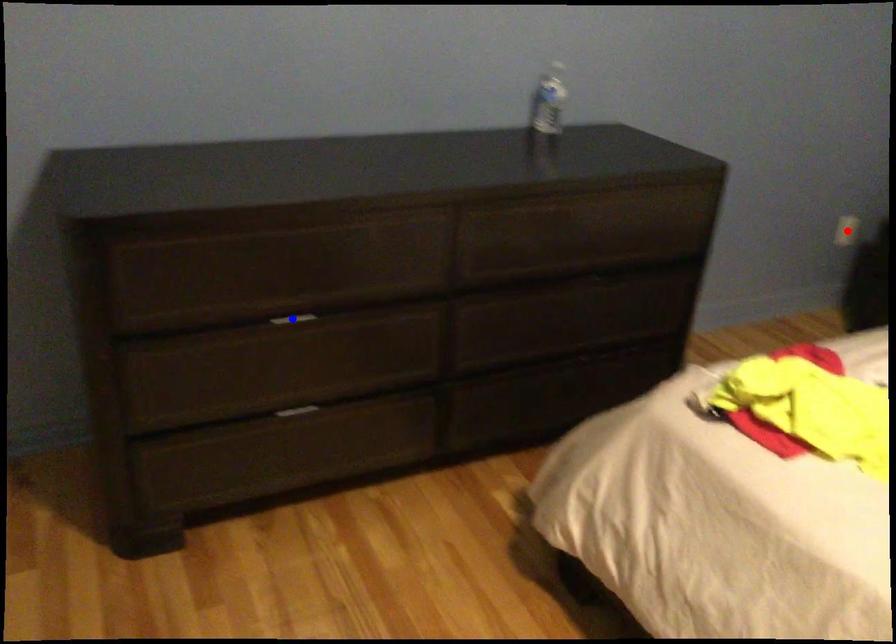
Question: Which of the two points in the image is closer to the camera?

Choices:
 (A) Blue point is closer.
 (B) Red point is closer.

Answer: (A)